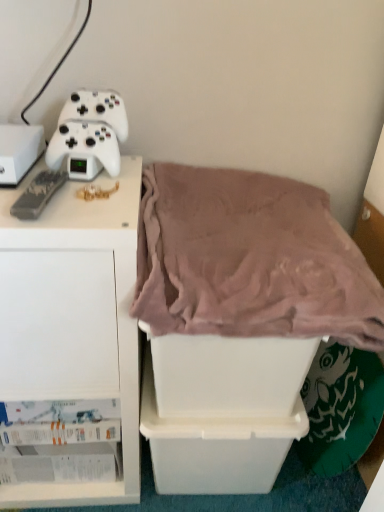
Question: In which direction should I rotate to look at white plastic storage box at center, acting as the third storage box starting from the left?

Choices:
 (A) right
 (B) left

Answer: (A)

Question: Does white matte game controller at upper left, placed as the 1th game controller when sorted from top to bottom, come in front of white plastic storage box at left, placed as the 1th storage box when sorted from left to right?

Choices:
 (A) no
 (B) yes

Answer: (A)

Question: Is white matte game controller at upper left, placed as the 1th game controller when sorted from top to bottom, positioned beyond the bounds of white plastic storage box at left, which appears as the 3th storage box when ordered from the bottom?

Choices:
 (A) yes
 (B) no

Answer: (A)

Question: From a real-world perspective, does white matte game controller at upper left, which is the 2th game controller in bottom-to-top order, stand above white plastic storage box at left, arranged as the 1th storage box when viewed from the top?

Choices:
 (A) no
 (B) yes

Answer: (B)

Question: Considering the relative sizes of white matte game controller at upper left, the 2th game controller in the front-to-back sequence, and white plastic storage box at left, placed as the 1th storage box when sorted from left to right, in the image provided, is white matte game controller at upper left, the 2th game controller in the front-to-back sequence, smaller than white plastic storage box at left, placed as the 1th storage box when sorted from left to right,?

Choices:
 (A) no
 (B) yes

Answer: (B)

Question: Is white matte game controller at upper left, the 2th game controller in the front-to-back sequence, oriented away from white plastic storage box at left, arranged as the 1th storage box when viewed from the top?

Choices:
 (A) yes
 (B) no

Answer: (B)

Question: Can you confirm if white matte game controller at upper left, the first game controller when ordered from back to front, is shorter than white plastic storage box at left, which appears as the 3th storage box when ordered from the bottom?

Choices:
 (A) no
 (B) yes

Answer: (A)

Question: Considering the relative sizes of white matte cabinet at left and white plastic storage box at center, the second storage box from the top, in the image provided, is white matte cabinet at left thinner than white plastic storage box at center, the second storage box from the top,?

Choices:
 (A) yes
 (B) no

Answer: (B)

Question: Does white matte cabinet at left contain white plastic storage box at center, the second storage box from the top?

Choices:
 (A) no
 (B) yes

Answer: (A)

Question: Is white matte cabinet at left completely or partially outside of white plastic storage box at center, which is counted as the first storage box, starting from the right?

Choices:
 (A) no
 (B) yes

Answer: (B)

Question: Can you confirm if white matte cabinet at left is shorter than white plastic storage box at center, acting as the third storage box starting from the left?

Choices:
 (A) yes
 (B) no

Answer: (B)

Question: Considering the relative positions of white matte cabinet at left and white plastic storage box at center, marked as the 2th storage box in a bottom-to-top arrangement, in the image provided, is white matte cabinet at left to the right of white plastic storage box at center, marked as the 2th storage box in a bottom-to-top arrangement, from the viewer's perspective?

Choices:
 (A) no
 (B) yes

Answer: (A)

Question: From a real-world perspective, does white matte cabinet at left stand above white plastic storage box at center, acting as the third storage box starting from the left?

Choices:
 (A) yes
 (B) no

Answer: (B)

Question: From the image's perspective, is mauve plush blanket at center located beneath white matte cabinet at left?

Choices:
 (A) no
 (B) yes

Answer: (A)